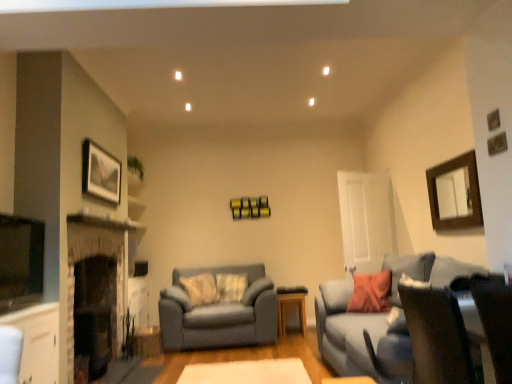
This screenshot has width=512, height=384. What do you see at coordinates (247, 372) in the screenshot? I see `white felt rug at center` at bounding box center [247, 372].

Describe the element at coordinates (455, 193) in the screenshot. I see `wooden mirror at upper right, the second picture frame positioned from the left` at that location.

In order to click on matte gray couch at center, placed as the first studio couch when sorted from back to front in this screenshot , I will do `click(219, 313)`.

This screenshot has height=384, width=512. I want to click on dark brown leather swivel chair at lower right, so click(436, 334).

Does white glossy door at center touch dark stone fireplace at left?

No, white glossy door at center is not in contact with dark stone fireplace at left.

Does point (360, 198) come in front of point (116, 278)?

That is False.

In the scene shown: Is white glossy door at center completely or partially outside of dark stone fireplace at left?

Absolutely, white glossy door at center is external to dark stone fireplace at left.

Which object is closer to the camera taking this photo, white glossy door at center or matte gray couch at right, arranged as the second studio couch when viewed from the back?

matte gray couch at right, arranged as the second studio couch when viewed from the back, is closer to the camera.

You are a GUI agent. You are given a task and a screenshot of the screen. Output one action in this format:
    pyautogui.click(x=<x>, y=<y>)
    Task: Click on the glass door that appears behind the matte gray couch at right, marked as the 2th studio couch in a left-to-right arrangement
    
    Given the screenshot: What is the action you would take?
    pyautogui.click(x=365, y=220)

From a real-world perspective, which object rests below the other?

From a 3D spatial view, matte gray couch at right, marked as the 2th studio couch in a left-to-right arrangement, is below.

Is white glossy door at center outside of matte gray couch at right, marked as the 2th studio couch in a left-to-right arrangement?

That's correct, white glossy door at center is outside of matte gray couch at right, marked as the 2th studio couch in a left-to-right arrangement.

Which point is more forward, (244, 295) or (105, 177)?

The point (105, 177) is closer.

Between matte gray couch at center, placed as the first studio couch when sorted from back to front, and matte silver picture frame at upper left, positioned as the 1th picture frame in left-to-right order, which one has larger width?

Wider between the two is matte gray couch at center, placed as the first studio couch when sorted from back to front.

Between matte gray couch at center, the second studio couch in the right-to-left sequence, and matte silver picture frame at upper left, which is the 2th picture frame in right-to-left order, which one has smaller size?

matte silver picture frame at upper left, which is the 2th picture frame in right-to-left order, is smaller.

How distant is matte gray couch at center, the 1th studio couch when ordered from left to right, from matte silver picture frame at upper left, which is the 2th picture frame in right-to-left order?

matte gray couch at center, the 1th studio couch when ordered from left to right, is 5.83 feet from matte silver picture frame at upper left, which is the 2th picture frame in right-to-left order.

From the image's perspective, is white felt rug at center above or below light brown wooden table at center?

white felt rug at center is below light brown wooden table at center.

Is white felt rug at center smaller than light brown wooden table at center?

Yes.

Between point (190, 369) and point (302, 319), which one is positioned behind?

The point (302, 319) is more distant.

From the picture: How distant is white felt rug at center from light brown wooden table at center?

white felt rug at center is 1.26 meters from light brown wooden table at center.

Relative to dark brown leather swivel chair at lower right, is matte gray couch at center, the second studio couch in the right-to-left sequence, in front or behind?

Clearly, matte gray couch at center, the second studio couch in the right-to-left sequence, is behind dark brown leather swivel chair at lower right.

From the image's perspective, which is above, matte gray couch at center, the second studio couch positioned from the front, or dark brown leather swivel chair at lower right?

dark brown leather swivel chair at lower right is shown above in the image.

Based on the photo, considering the relative sizes of matte gray couch at center, the second studio couch positioned from the front, and dark brown leather swivel chair at lower right in the image provided, is matte gray couch at center, the second studio couch positioned from the front, thinner than dark brown leather swivel chair at lower right?

No.

Is matte silver picture frame at upper left, which is the 2th picture frame in right-to-left order, turned away from white glossy door at center?

That's not correct — matte silver picture frame at upper left, which is the 2th picture frame in right-to-left order, is not looking away from white glossy door at center.

From a real-world perspective, does matte silver picture frame at upper left, which is the 2th picture frame in right-to-left order, stand above white glossy door at center?

Indeed, from a real-world perspective, matte silver picture frame at upper left, which is the 2th picture frame in right-to-left order, stands above white glossy door at center.

Looking at this image, from the image's perspective, who appears lower, matte silver picture frame at upper left, positioned as the 1th picture frame in left-to-right order, or white glossy door at center?

white glossy door at center, from the image's perspective.

Looking at this image, how much distance is there between matte silver picture frame at upper left, which is the 2th picture frame in right-to-left order, and white glossy door at center?

3.15 meters.

From the image's perspective, between white felt rug at center and matte silver picture frame at upper left, positioned as the 1th picture frame in left-to-right order, which one is located above?

matte silver picture frame at upper left, positioned as the 1th picture frame in left-to-right order, from the image's perspective.

Is white felt rug at center at the right side of matte silver picture frame at upper left, positioned as the 1th picture frame in left-to-right order?

Indeed, white felt rug at center is positioned on the right side of matte silver picture frame at upper left, positioned as the 1th picture frame in left-to-right order.

Based on their sizes in the image, would you say white felt rug at center is bigger or smaller than matte silver picture frame at upper left, which is the 2th picture frame in right-to-left order?

Clearly, white felt rug at center is larger in size than matte silver picture frame at upper left, which is the 2th picture frame in right-to-left order.

At what (x,y) coordinates should I click in order to perform the action: click on fireplace below the white glossy door at center (from the image's perspective). Please return your answer as a coordinate pair (x, y). This screenshot has width=512, height=384. Looking at the image, I should click on [95, 312].

You are a GUI agent. You are given a task and a screenshot of the screen. Output one action in this format:
    pyautogui.click(x=<x>, y=<y>)
    Task: Click on the 1st studio couch directly beneath the white glossy door at center (from a real-world perspective)
    This screenshot has width=512, height=384.
    Given the screenshot: What is the action you would take?
    pyautogui.click(x=385, y=319)

When comparing their distances from wooden mirror at upper right, the second picture frame positioned from the left, does matte gray couch at center, placed as the first studio couch when sorted from back to front, or matte gray couch at right, arranged as the second studio couch when viewed from the back, seem closer?

Based on the image, matte gray couch at right, arranged as the second studio couch when viewed from the back, appears to be nearer to wooden mirror at upper right, the second picture frame positioned from the left.

From the image, which object appears to be nearer to white glossy door at center, matte gray couch at right, marked as the 2th studio couch in a left-to-right arrangement, or dark stone fireplace at left?

Among the two, matte gray couch at right, marked as the 2th studio couch in a left-to-right arrangement, is located nearer to white glossy door at center.

From the picture: Based on their spatial positions, is white glossy door at center or light brown wooden table at center closer to white felt rug at center?

The object closer to white felt rug at center is light brown wooden table at center.

Considering their positions, is white felt rug at center positioned further to dark brown leather swivel chair at lower right than dark stone fireplace at left?

The object further to dark brown leather swivel chair at lower right is dark stone fireplace at left.

Considering their positions, is dark stone fireplace at left positioned further to white felt rug at center than matte gray couch at right, arranged as the second studio couch when viewed from the back?

The object further to white felt rug at center is dark stone fireplace at left.

When comparing their distances from light brown wooden table at center, does wooden mirror at upper right, the second picture frame positioned from the left, or matte silver picture frame at upper left, positioned as the 1th picture frame in left-to-right order, seem closer?

wooden mirror at upper right, the second picture frame positioned from the left, is closer to light brown wooden table at center.

Which object lies further to the anchor point matte silver picture frame at upper left, positioned as the 1th picture frame in left-to-right order, wooden mirror at upper right, which is the first picture frame from right to left, or white felt rug at center?

wooden mirror at upper right, which is the first picture frame from right to left, lies further to matte silver picture frame at upper left, positioned as the 1th picture frame in left-to-right order, than the other object.

Looking at the image, which one is located further to white felt rug at center, matte gray couch at center, placed as the first studio couch when sorted from back to front, or dark stone fireplace at left?

Based on the image, dark stone fireplace at left appears to be further to white felt rug at center.

The image size is (512, 384). What are the coordinates of `glass door positioned between matte gray couch at right, marked as the 2th studio couch in a left-to-right arrangement, and matte gray couch at center, the second studio couch positioned from the front, from near to far` in the screenshot? It's located at (365, 220).

Locate an element on the screen. studio couch between white felt rug at center and light brown wooden table at center in the front-back direction is located at coordinates (219, 313).

Locate an element on the screen. picture frame between white felt rug at center and light brown wooden table at center from front to back is located at coordinates (101, 172).

The width and height of the screenshot is (512, 384). Find the location of `glass door positioned between wooden mirror at upper right, the second picture frame positioned from the left, and light brown wooden table at center from near to far`. glass door positioned between wooden mirror at upper right, the second picture frame positioned from the left, and light brown wooden table at center from near to far is located at coordinates (365, 220).